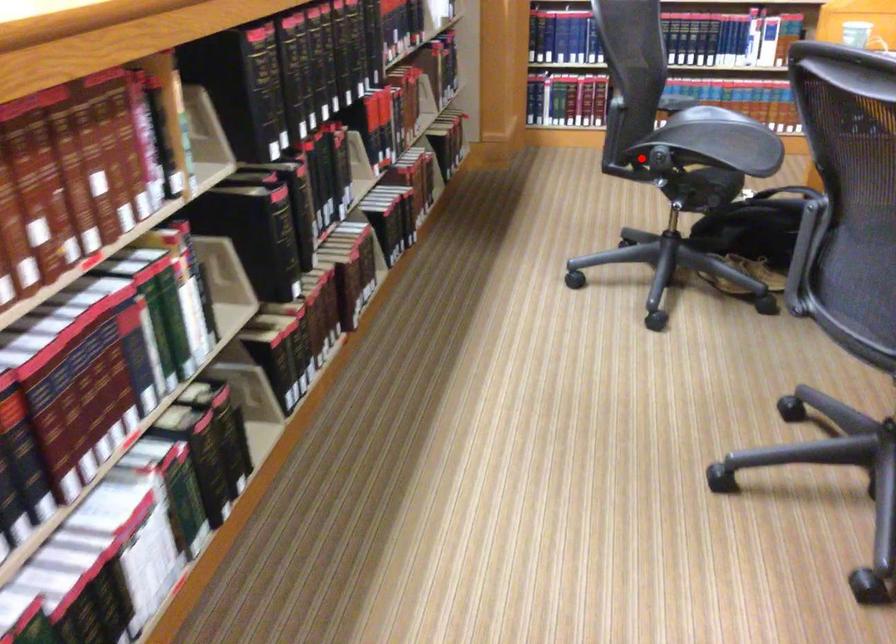
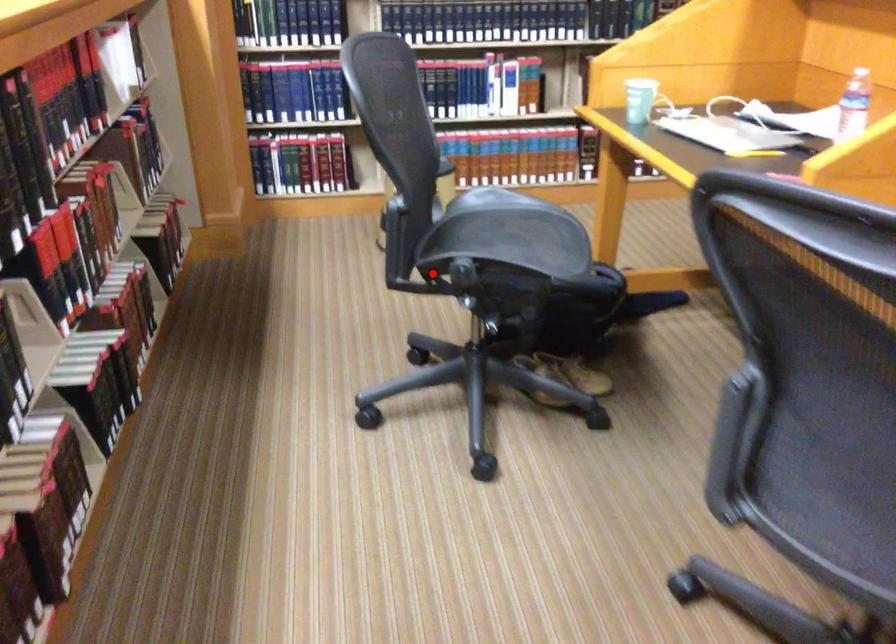
I am providing you with two images of the same scene from different viewpoints. A red point is marked on the first image and another point is marked on the second image. Are the points marked in image1 and image2 representing the same 3D position?

Yes